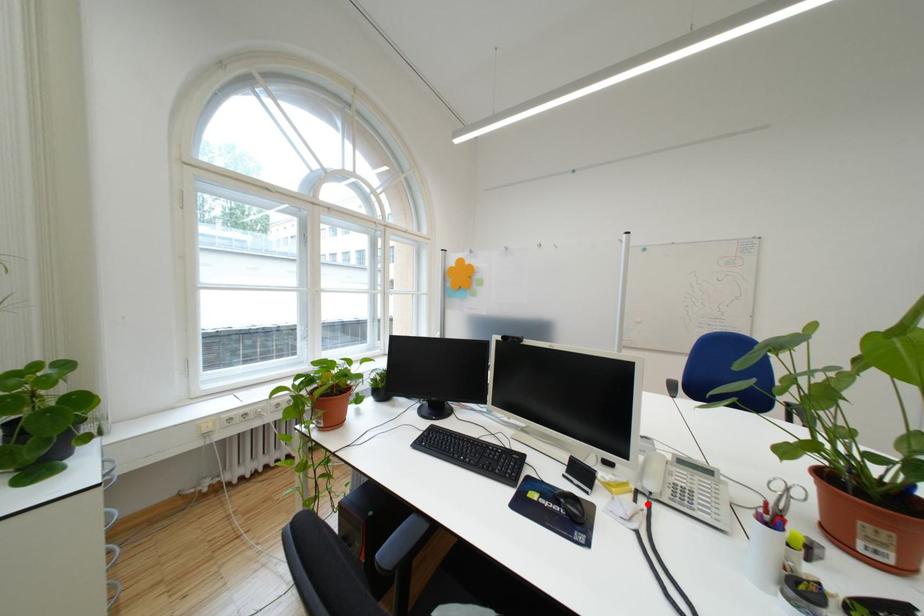
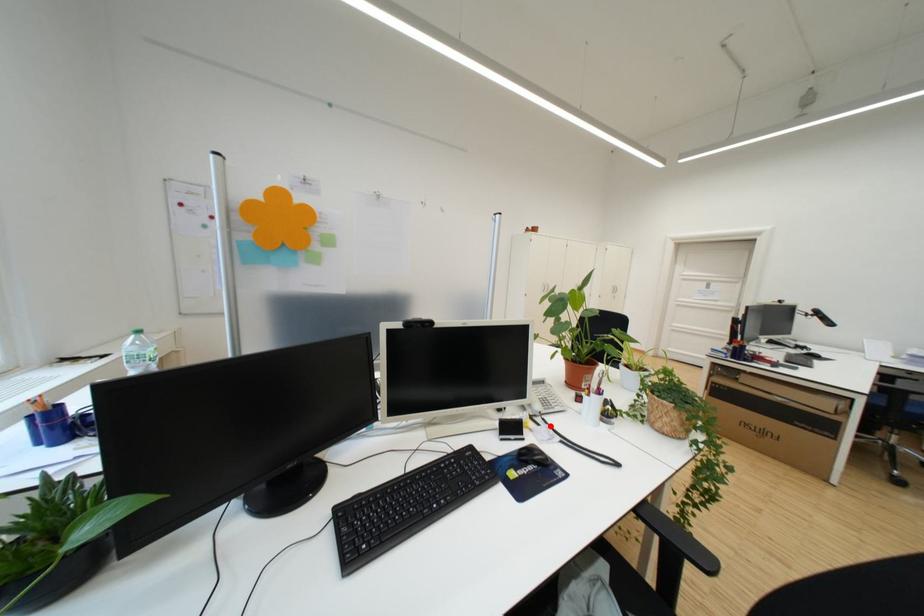
I am providing you with two images of the same scene from different viewpoints. A red point is marked on the first image and another point is marked on the second image. Do the highlighted points in image1 and image2 indicate the same real-world spot?

Yes